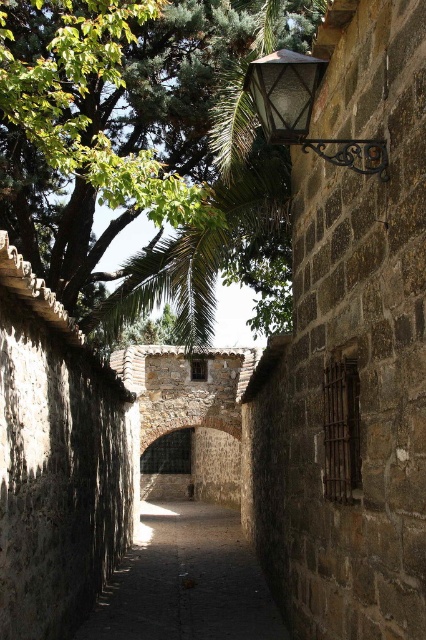
You are a delivery person with a cart that is 10 feet wide. You need to navigate through the narrow alleyway shown in the image. The alleyway has a dark stone path at center and a matte glass lamp at upper right. Can your cart fit between these two objects without touching them?

The dark stone path at center and the matte glass lamp at upper right are 103.89 feet apart. Since your cart is only 10 feet wide, there is more than enough space for it to pass through without touching either object.

You are standing in the middle of the alleyway and notice the green leafy tree at upper left and the matte glass lamp at upper right. Which object is positioned farther to the left?

The green leafy tree at upper left is positioned farther to the left than the matte glass lamp at upper right.

You are a painter standing in the narrow alleyway. You want to paint the green leafy tree at upper left and the dark stone path at center. Which object will require you to look upwards more?

The green leafy tree at upper left is much taller than the dark stone path at center, so you will need to look upwards more to paint the green leafy tree at upper left.